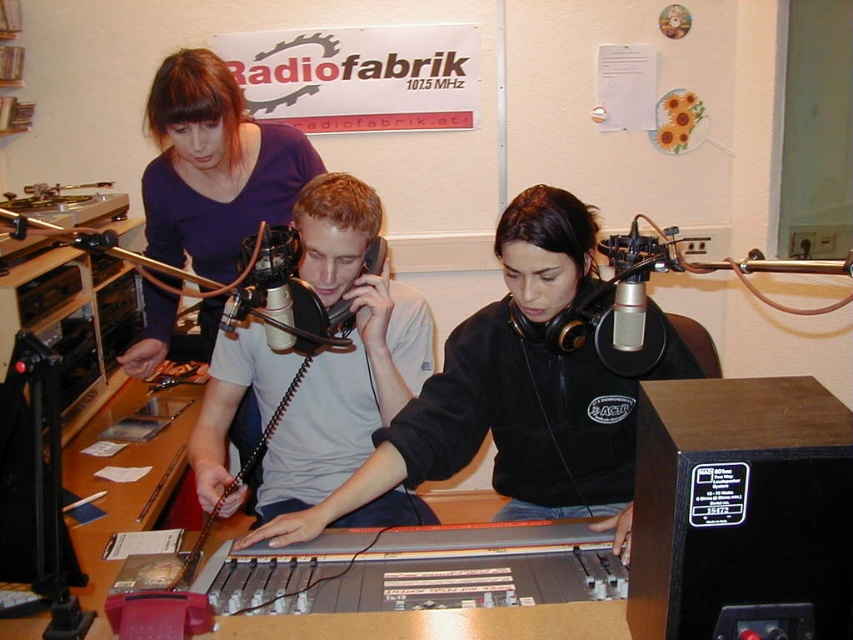
You are a costume designer preparing for a live radio show. You need to ensure that the two presenters wearing the matte gray shirt at center and the white matte shirt at center are visible to the audience. Based on their current positions, which shirt is more likely to be seen by viewers watching the broadcast?

The matte gray shirt at center is more likely to be seen because it might be wider than the white matte shirt at center, making it stand out more in the frame.

From the picture: You are a technician in the studio and need to adjust the microphone between the matte gray shirt at center and the matte purple shirt at upper left. Which direction should you move to reach the microphone first?

The microphone is located between the matte gray shirt at center and the matte purple shirt at upper left, so you should move towards either of them to reach the microphone first.

You are a technician in the radio station. You need to place a new microphone stand exactly halfway between the camera and the point at coordinate point (x=537, y=394). Where should you place the microphone stand?

The microphone stand should be placed at a distance of 0.75 meters from the camera towards the point at coordinate point (x=537, y=394), since halfway between 1.50 meters is 0.75 meters.